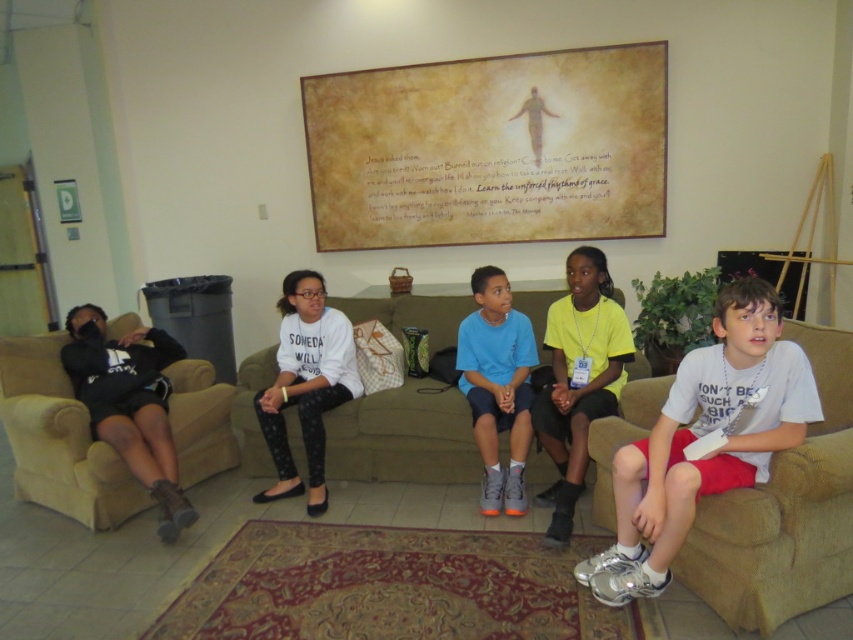
You are a photographer standing in front of the couch where the children are sitting. You want to take a photo of both the point at coordinates (460, 456) and the point at (514, 426). Which point will appear closer to the camera in the final photo?

Point (460, 456) is further to the camera than point (514, 426), so in the photo, point (460, 456) will appear closer to the camera than point (514, 426).

You are trying to decide whether to place a new throw pillow on the green fabric couch at center. Considering the size of the yellow matte shirt at center, can you determine if the couch is wide enough to accommodate the pillow without overcrowding?

The green fabric couch at center might be wider than yellow matte shirt at center, so there might be enough space for the throw pillow.

You are a photographer trying to capture a group shot of the children sitting on the green fabric couch at center and wearing the yellow matte shirt at center. To ensure both are in the frame, where should you position yourself relative to the children?

You should position yourself to the right of the children so that the green fabric couch at center, which is to the left of the yellow matte shirt at center, remains in view along with the yellow matte shirt at center.